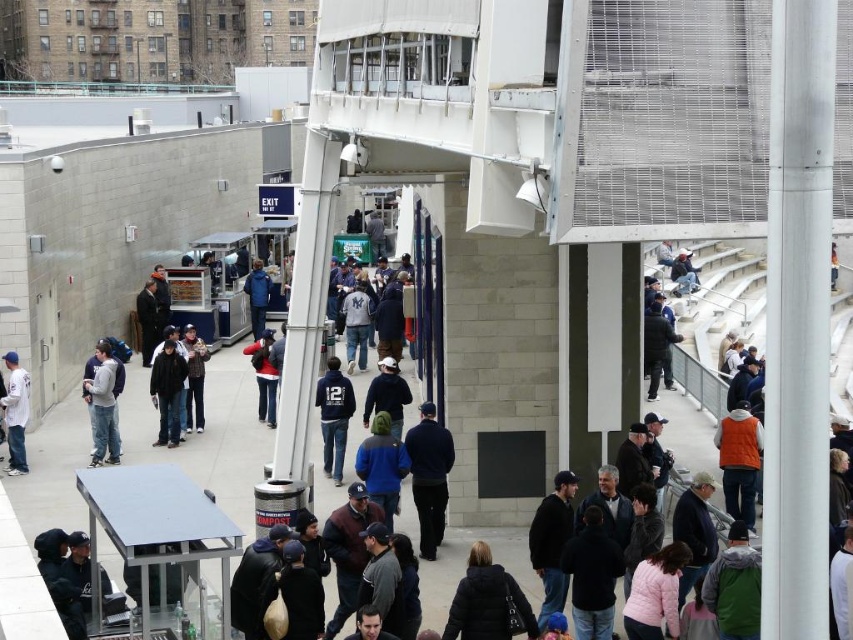
You are a photographer trying to capture a photo of the orange fleece jacket at right without including the dark blue sweater at center in the frame. Given their positions, is this possible?

The dark blue sweater at center is above the orange fleece jacket at right, so if you position your camera to focus on the lower area where the orange fleece jacket at right is located, you can exclude the dark blue sweater at center from the frame.

You are a photographer trying to capture a candid shot of both the dark blue sweater at center and the dark blue jacket at center. Since you want to ensure both subjects are fully in frame, you need to know which one is wider. Which clothing item has a greater width?

The dark blue sweater at center has a greater width than the dark blue jacket at center.

You are a photographer trying to capture a candid shot of both the orange fleece jacket at right and the white cotton baseball cap at left. Since you want to ensure both are clearly visible in the frame, which one should you focus on first to account for their sizes?

The orange fleece jacket at right is bigger than the white cotton baseball cap at left, so you should focus on the orange fleece jacket at right first to ensure it is in clear focus before adjusting for the smaller cap.